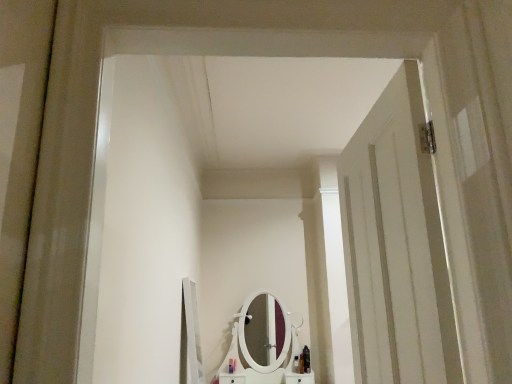
Question: Is white wooden door at right bigger or smaller than shiny black bottle at center, which appears as the 2th toiletry when viewed from the right?

Choices:
 (A) big
 (B) small

Answer: (A)

Question: Which is correct: white wooden door at right is inside shiny black bottle at center, the 4th toiletry from the left, or outside of it?

Choices:
 (A) inside
 (B) outside

Answer: (B)

Question: Which of these objects is positioned closest to the translucent plastic bottle at center, which appears as the 2th toiletry when viewed from the left?

Choices:
 (A) translucent plastic bottle at center, the 3th toiletry from the left
 (B) shiny black bottle at lower center, the 5th toiletry viewed from the left
 (C) translucent plastic bottle at center, placed as the 1th toiletry when sorted from left to right
 (D) shiny black bottle at center, the 4th toiletry from the left
 (E) white wooden door at right

Answer: (C)

Question: Estimate the real-world distances between objects in this image. Which object is closer to the translucent plastic bottle at center, positioned as the 5th toiletry in right-to-left order?

Choices:
 (A) translucent plastic bottle at center, which appears as the 2th toiletry when viewed from the left
 (B) shiny black bottle at lower center, which appears as the first toiletry when viewed from the right
 (C) white wooden door at right
 (D) shiny black bottle at center, which appears as the 2th toiletry when viewed from the right
 (E) translucent plastic bottle at center, the 3th toiletry from the left

Answer: (A)